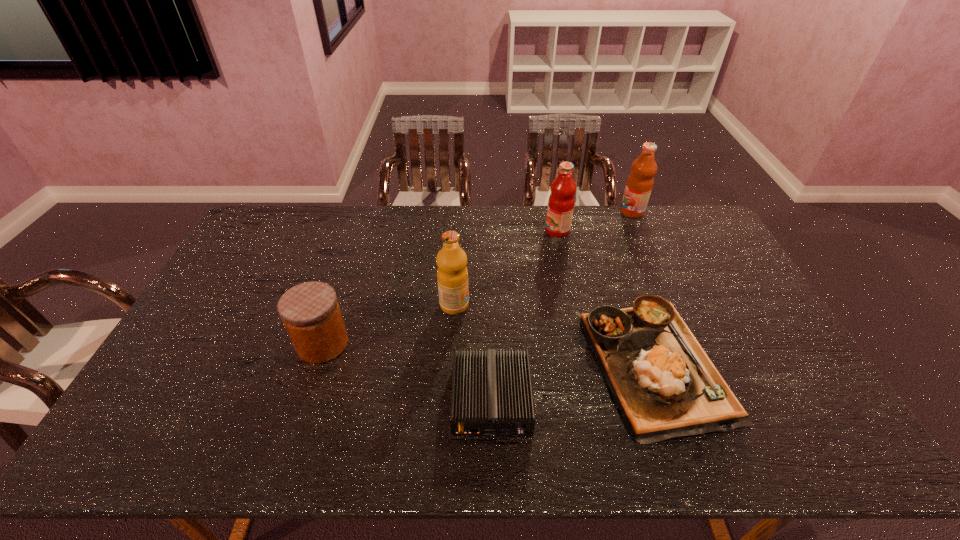
This screenshot has width=960, height=540. Identify the location of vacant space that satisfies the following two spatial constraints: 1. on the front label of the fifth nearest object; 2. on the back panel of the router. (593, 400).

Where is `free space that satisfies the following two spatial constraints: 1. on the front label of the farthest object; 2. on the front side of the platter`? free space that satisfies the following two spatial constraints: 1. on the front label of the farthest object; 2. on the front side of the platter is located at coordinates (698, 363).

The width and height of the screenshot is (960, 540). Find the location of `vacant point that satisfies the following two spatial constraints: 1. on the front label of the second nearest fruit juice; 2. on the front side of the fourth tallest object`. vacant point that satisfies the following two spatial constraints: 1. on the front label of the second nearest fruit juice; 2. on the front side of the fourth tallest object is located at coordinates (581, 343).

The height and width of the screenshot is (540, 960). I want to click on free space that satisfies the following two spatial constraints: 1. on the front label of the farthest fruit juice; 2. on the back panel of the router, so click(x=714, y=400).